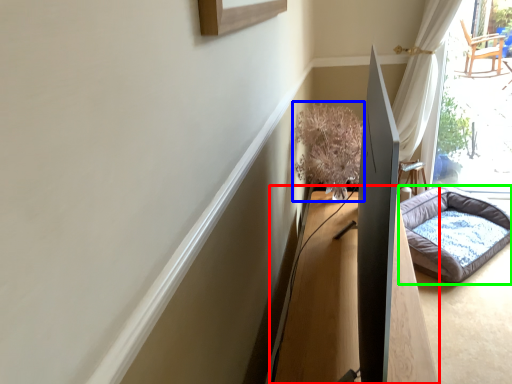
Question: Considering the real-world distances, which object is closest to table (highlighted by a red box)? plant (highlighted by a blue box) or dog bed (highlighted by a green box).

Choices:
 (A) plant
 (B) dog bed

Answer: (A)